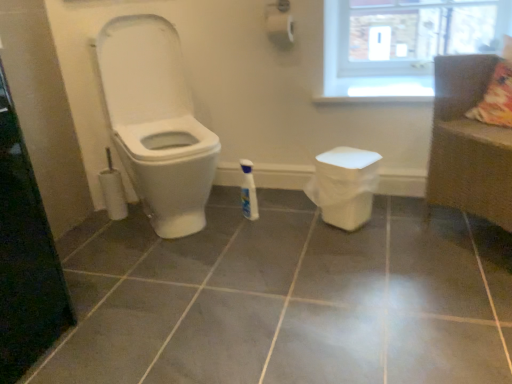
Question: Considering the relative positions of brown woven couch at right and white glossy toilet at left in the image provided, is brown woven couch at right to the left or to the right of white glossy toilet at left?

Choices:
 (A) right
 (B) left

Answer: (A)

Question: Looking at their shapes, would you say brown woven couch at right is wider or thinner than white glossy toilet at left?

Choices:
 (A) wide
 (B) thin

Answer: (B)

Question: Which object is the closest to the white glossy bottle at center?

Choices:
 (A) transparent glass screen door at left
 (B) white glossy toilet at left
 (C) brown woven couch at right
 (D) transparent glass window at upper right
 (E) gray glossy tile at center

Answer: (B)

Question: Estimate the real-world distances between objects in this image. Which object is farther from the white glossy toilet at left?

Choices:
 (A) white glossy bottle at center
 (B) brown woven couch at right
 (C) transparent glass window at upper right
 (D) gray glossy tile at center
 (E) transparent glass screen door at left

Answer: (B)